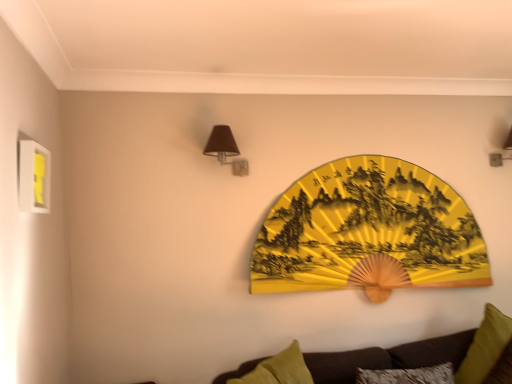
Question: From the image's perspective, would you say yellow paper fan at center is positioned over yellow matte picture frame at upper left?

Choices:
 (A) no
 (B) yes

Answer: (A)

Question: Is yellow paper fan at center wider than yellow matte picture frame at upper left?

Choices:
 (A) no
 (B) yes

Answer: (B)

Question: Considering the relative sizes of yellow paper fan at center and yellow matte picture frame at upper left in the image provided, is yellow paper fan at center taller than yellow matte picture frame at upper left?

Choices:
 (A) yes
 (B) no

Answer: (A)

Question: Are yellow paper fan at center and yellow matte picture frame at upper left beside each other?

Choices:
 (A) no
 (B) yes

Answer: (A)

Question: Is yellow paper fan at center positioned with its back to yellow matte picture frame at upper left?

Choices:
 (A) no
 (B) yes

Answer: (A)

Question: From a real-world perspective, is yellow paper fan at center over yellow matte picture frame at upper left?

Choices:
 (A) no
 (B) yes

Answer: (A)

Question: From the image's perspective, is yellow paper fan at center on matte brown wall sconce at upper right, the 1th lamp in the right-to-left sequence?

Choices:
 (A) no
 (B) yes

Answer: (A)

Question: Is yellow paper fan at center at the left side of matte brown wall sconce at upper right, which is the first lamp in back-to-front order?

Choices:
 (A) yes
 (B) no

Answer: (A)

Question: Is yellow paper fan at center behind matte brown wall sconce at upper right, which is the first lamp in back-to-front order?

Choices:
 (A) no
 (B) yes

Answer: (A)

Question: From a real-world perspective, is yellow paper fan at center beneath matte brown wall sconce at upper right, which is the first lamp in back-to-front order?

Choices:
 (A) yes
 (B) no

Answer: (A)

Question: Is yellow paper fan at center bigger than matte brown wall sconce at upper right, the 1th lamp in the right-to-left sequence?

Choices:
 (A) yes
 (B) no

Answer: (A)

Question: Is yellow paper fan at center not within matte brown wall sconce at upper right, marked as the second lamp in a front-to-back arrangement?

Choices:
 (A) yes
 (B) no

Answer: (A)

Question: Is matte brown wall sconce at upper right, marked as the second lamp in a front-to-back arrangement, positioned before dark brown fabric couch at lower right?

Choices:
 (A) yes
 (B) no

Answer: (B)